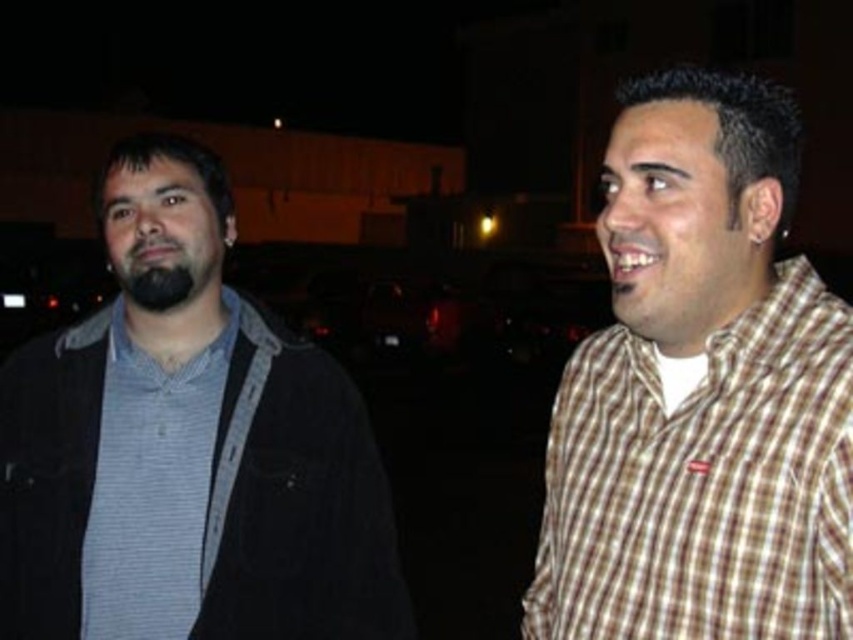
Question: Is matte black jacket at left thinner than gray striped shirt at left?

Choices:
 (A) no
 (B) yes

Answer: (A)

Question: Is matte black jacket at left further to the viewer compared to brown checkered shirt at right?

Choices:
 (A) no
 (B) yes

Answer: (B)

Question: Estimate the real-world distances between objects in this image. Which object is farther from the gray striped shirt at left?

Choices:
 (A) brown checkered shirt at right
 (B) matte black jacket at left

Answer: (A)

Question: Among these objects, which one is farthest from the camera?

Choices:
 (A) brown checkered shirt at right
 (B) matte black jacket at left

Answer: (B)

Question: From the image, what is the correct spatial relationship of brown checkered shirt at right in relation to gray striped shirt at left?

Choices:
 (A) below
 (B) above

Answer: (B)

Question: Which point is farther to the camera?

Choices:
 (A) (199, 529)
 (B) (74, 637)
 (C) (793, 492)

Answer: (A)